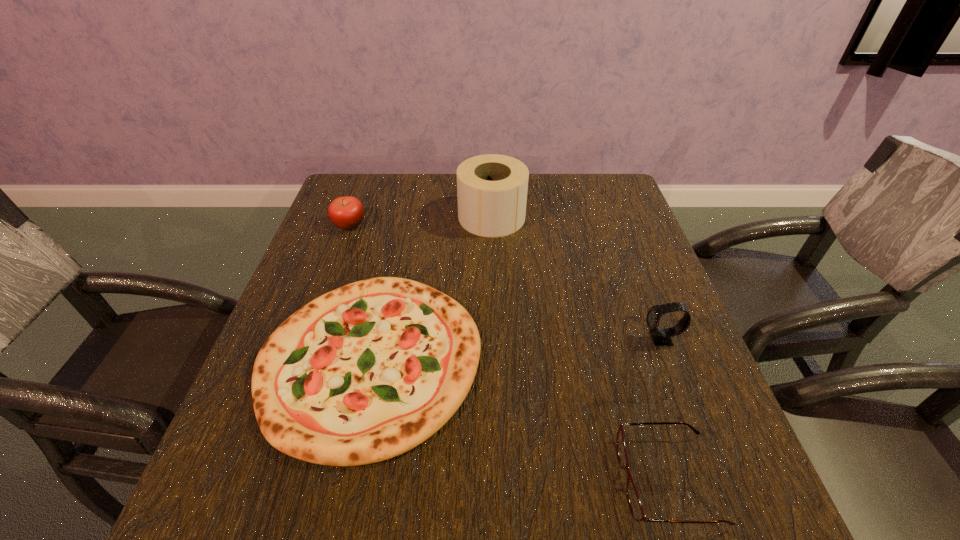
You are a GUI agent. You are given a task and a screenshot of the screen. Output one action in this format:
    pyautogui.click(x=<x>, y=<y>)
    Task: Click on the vacant area between the apple and the watch
    Image resolution: width=960 pixels, height=540 pixels.
    Given the screenshot: What is the action you would take?
    pos(505,282)

This screenshot has height=540, width=960. Identify the location of free point between the spectacles and the pizza. (519, 420).

Locate an element on the screen. vacant area between the toilet tissue and the watch is located at coordinates (576, 278).

Identify the location of object that is the fourth nearest to the watch. Image resolution: width=960 pixels, height=540 pixels. (347, 212).

Image resolution: width=960 pixels, height=540 pixels. I want to click on the second closest object relative to the apple, so [492, 189].

Locate an element on the screen. Image resolution: width=960 pixels, height=540 pixels. free point that satisfies the following two spatial constraints: 1. on the back side of the apple; 2. on the left side of the toilet tissue is located at coordinates (352, 217).

You are a GUI agent. You are given a task and a screenshot of the screen. Output one action in this format:
    pyautogui.click(x=<x>, y=<y>)
    Task: Click on the free space that satisfies the following two spatial constraints: 1. on the face of the watch; 2. on the front side of the pizza
    
    Given the screenshot: What is the action you would take?
    pyautogui.click(x=669, y=360)